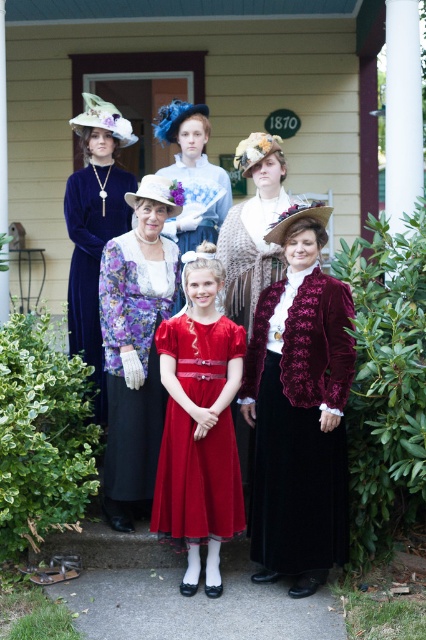
How much distance is there between velvet red dress at center and shiny red dress at center?

They are 15.97 inches apart.

Who is more distant from viewer, (256, 371) or (204, 509)?

Positioned behind is point (256, 371).

Describe the element at coordinates (299, 408) in the screenshot. I see `velvet red dress at center` at that location.

Locate an element on the screen. velvet red dress at center is located at coordinates (299, 408).

Does velvet dress at center have a greater width compared to velvet burgundy dress at center?

In fact, velvet dress at center might be narrower than velvet burgundy dress at center.

Does velvet dress at center come behind velvet burgundy dress at center?

No, velvet dress at center is in front of velvet burgundy dress at center.

Does point (86, 333) come closer to viewer compared to point (206, 188)?

Yes.

You are a GUI agent. You are given a task and a screenshot of the screen. Output one action in this format:
    pyautogui.click(x=<x>, y=<y>)
    Task: Click on the velvet dress at center
    This screenshot has height=640, width=426.
    Given the screenshot: What is the action you would take?
    pyautogui.click(x=94, y=227)

Does shiny red dress at center appear on the left side of velvet dress at center?

In fact, shiny red dress at center is to the right of velvet dress at center.

Is point (167, 502) positioned in front of point (77, 253)?

Yes, point (167, 502) is in front of point (77, 253).

The width and height of the screenshot is (426, 640). I want to click on shiny red dress at center, so click(x=196, y=481).